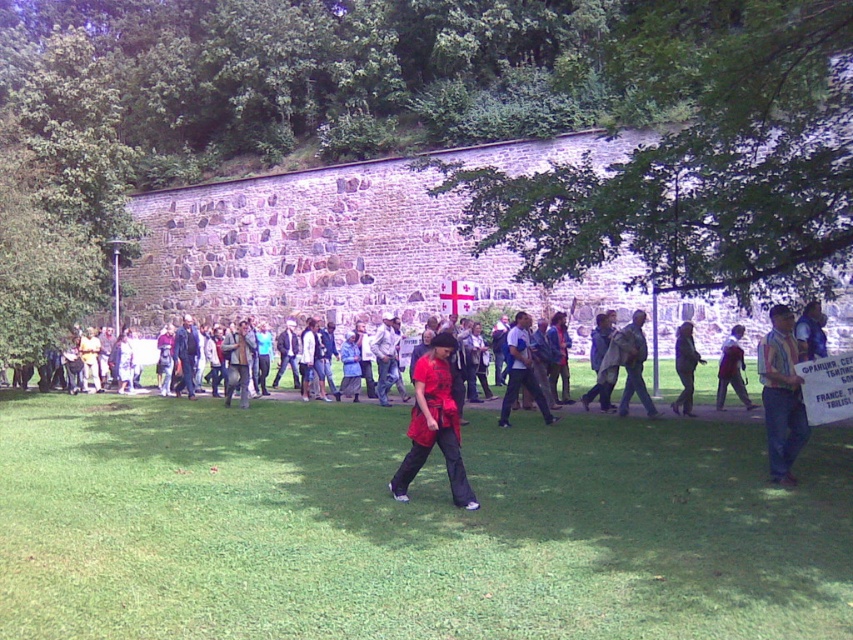
Question: Which point is farther to the camera?

Choices:
 (A) (466, 499)
 (B) (636, 380)
 (C) (732, 372)

Answer: (C)

Question: Is matte red shirt at center below matte black jacket at center?

Choices:
 (A) no
 (B) yes

Answer: (B)

Question: Can you confirm if matte black jacket at center is thinner than dark blue jeans at center?

Choices:
 (A) yes
 (B) no

Answer: (A)

Question: Based on their relative distances, which object is farther from the striped shirt at center?

Choices:
 (A) red shirt at center
 (B) matte red shirt at center
 (C) matte black jacket at center

Answer: (C)

Question: Does matte red shirt at center appear on the left side of red fabric jacket at center?

Choices:
 (A) no
 (B) yes

Answer: (B)

Question: Which point appears closest to the camera in this image?

Choices:
 (A) (543, 397)
 (B) (61, 600)

Answer: (B)